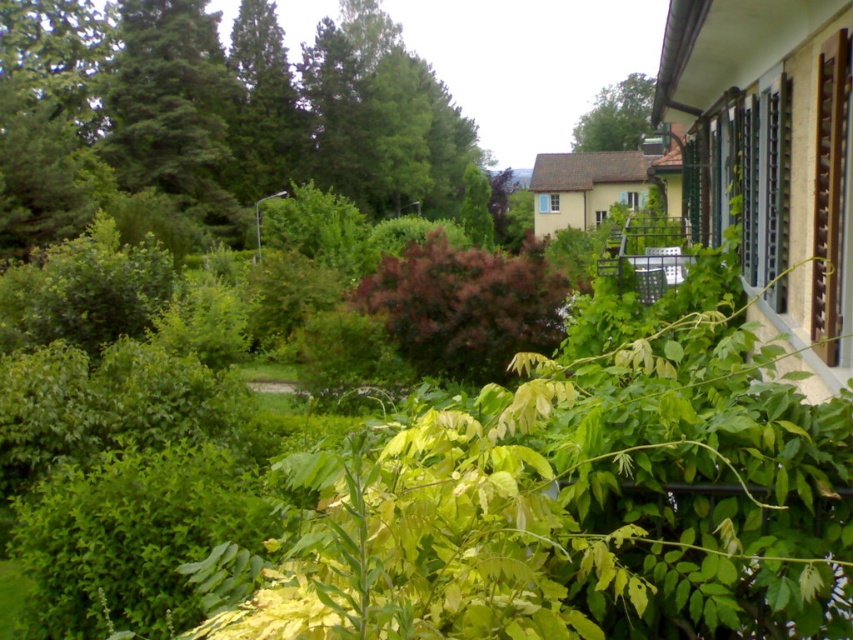
You are a gardener planning to plant a new flower bed between the green leafy tree at upper left and the purple matte bush at center. Considering their heights, which plant should you place closer to the front of the flower bed to ensure both are visible?

The purple matte bush at center should be placed closer to the front of the flower bed because the green leafy tree at upper left is taller and will naturally be seen from behind.

You are standing in the garden and want to take a photo of both the green leafy tree at upper left and the green matte tree at upper left. Which tree should you position yourself to the right of to include both in your shot?

You should position yourself to the right of the green matte tree at upper left because the green leafy tree at upper left is located to its right, ensuring both trees are within the frame.

You are standing in the garden and want to take a photo of the green leafy tree at upper left. Where should you position yourself to capture it in the frame?

To capture the green leafy tree at upper left in your photo, position yourself so that the tree is located near the upper left corner of your camera frame, corresponding to its 2D location at point (213, 113).